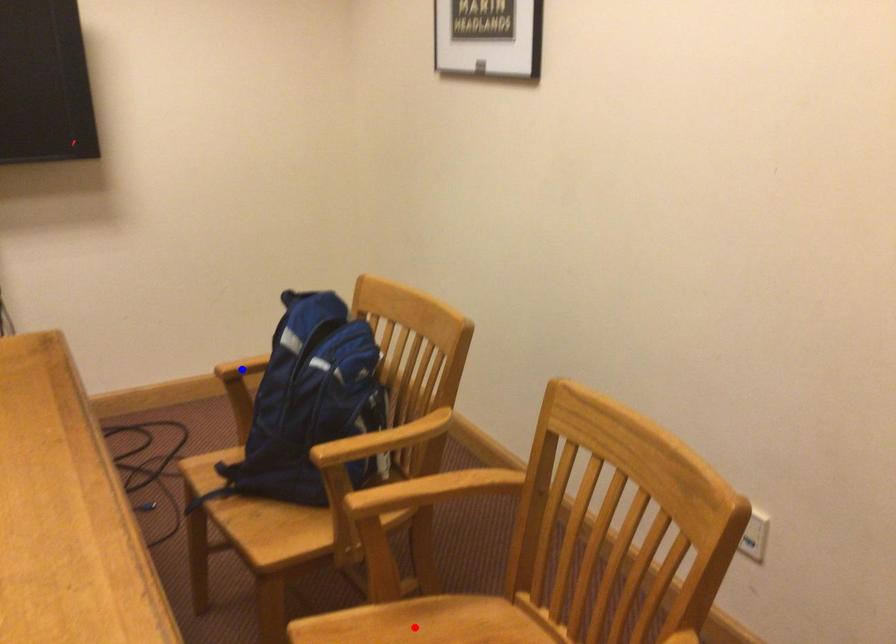
Question: Two points are marked on the image. Which point is closer to the camera?

Choices:
 (A) Blue point is closer.
 (B) Red point is closer.

Answer: (B)